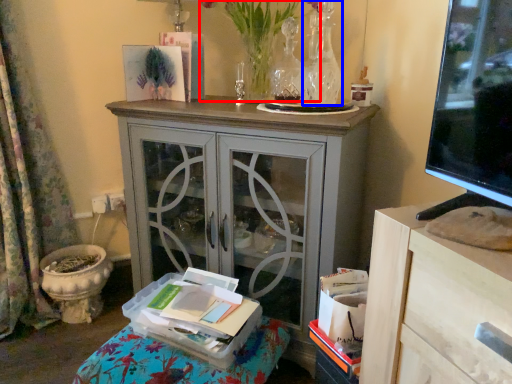
Question: Which of the following is the farthest to the observer, floral arrangement (highlighted by a red box) or vase (highlighted by a blue box)?

Choices:
 (A) floral arrangement
 (B) vase

Answer: (B)